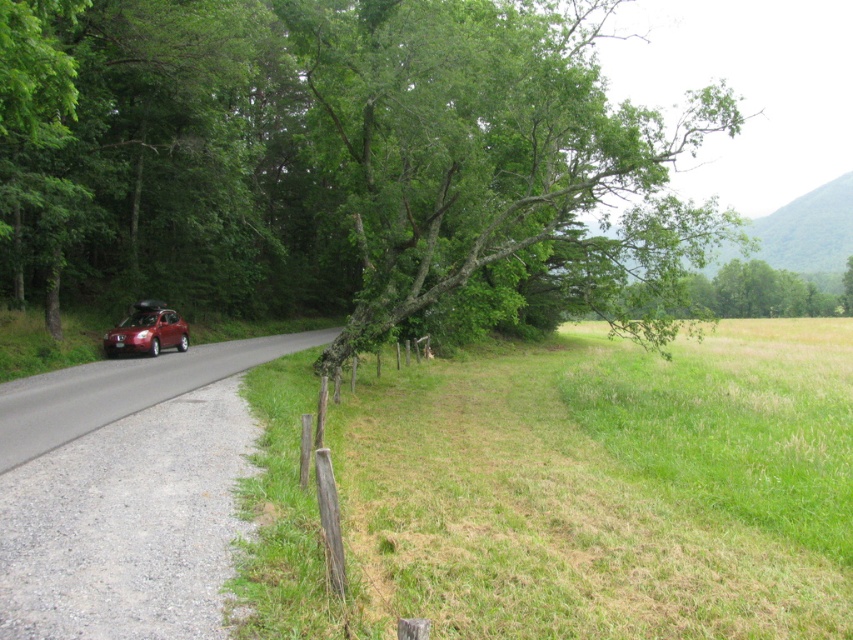
Question: Which object is farther from the camera taking this photo?

Choices:
 (A) green leafy tree at center
 (B) satin red suv at center-left

Answer: (B)

Question: Which point is farther to the camera?

Choices:
 (A) green leafy tree at center
 (B) satin red suv at center-left

Answer: (B)

Question: Can you confirm if green leafy tree at center is positioned to the left of satin red suv at center-left?

Choices:
 (A) no
 (B) yes

Answer: (A)

Question: Is green leafy tree at center wider than satin red suv at center-left?

Choices:
 (A) no
 (B) yes

Answer: (B)

Question: Is green leafy tree at center below satin red suv at center-left?

Choices:
 (A) yes
 (B) no

Answer: (B)

Question: Which of the following is the farthest from the observer?

Choices:
 (A) (643, 241)
 (B) (177, 321)

Answer: (B)